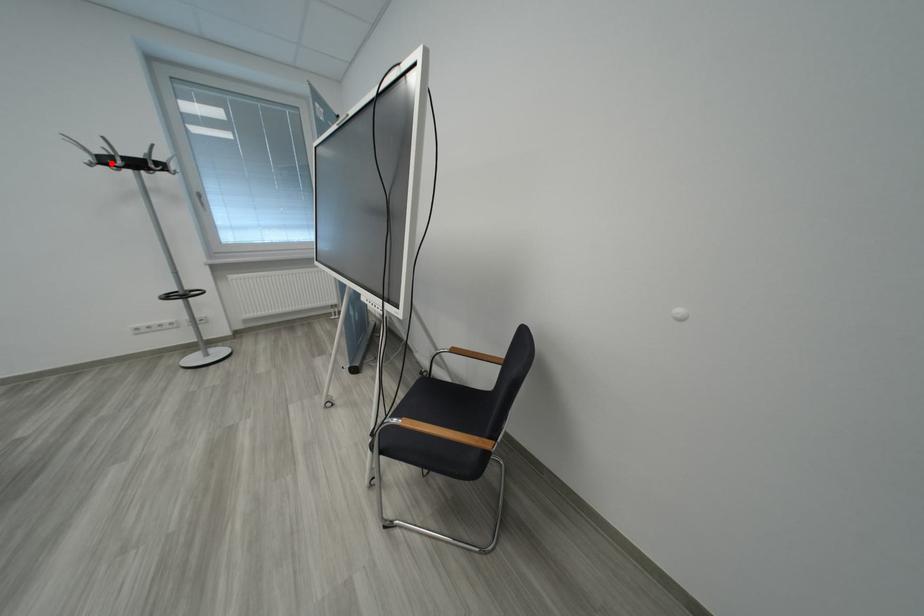
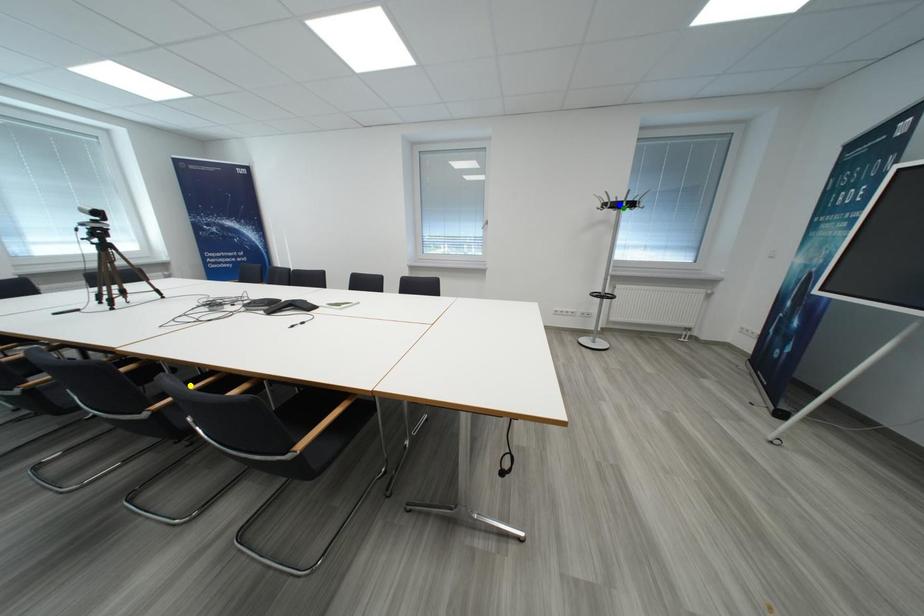
Question: I am providing you with two images of the same scene from different viewpoints. A red point is marked on the first image. You are given multiple points on the second image. Which mark in image 2 goes with the point in image 1?

Choices:
 (A) green point
 (B) yellow point
 (C) blue point

Answer: (A)